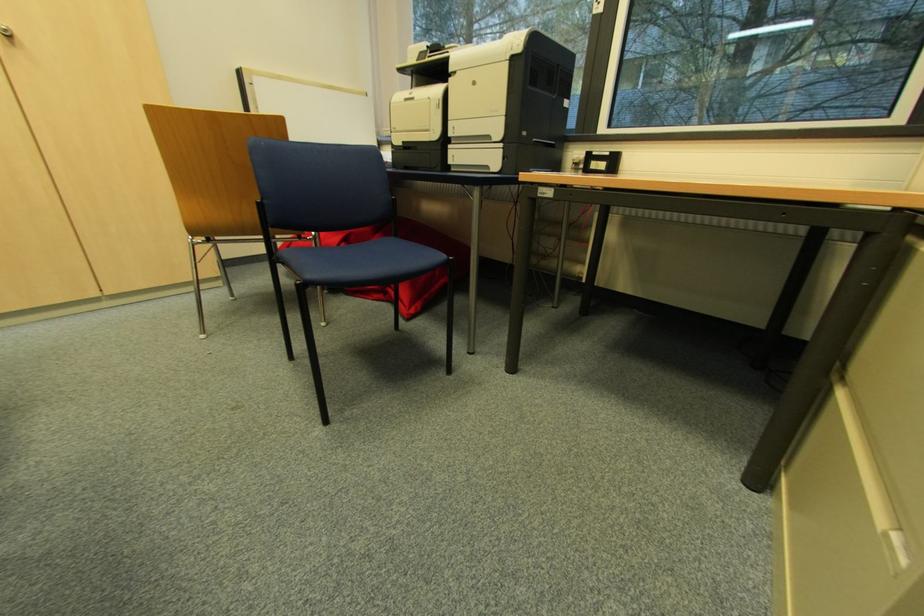
This screenshot has height=616, width=924. What do you see at coordinates (372, 253) in the screenshot?
I see `a blue chair sitting surface` at bounding box center [372, 253].